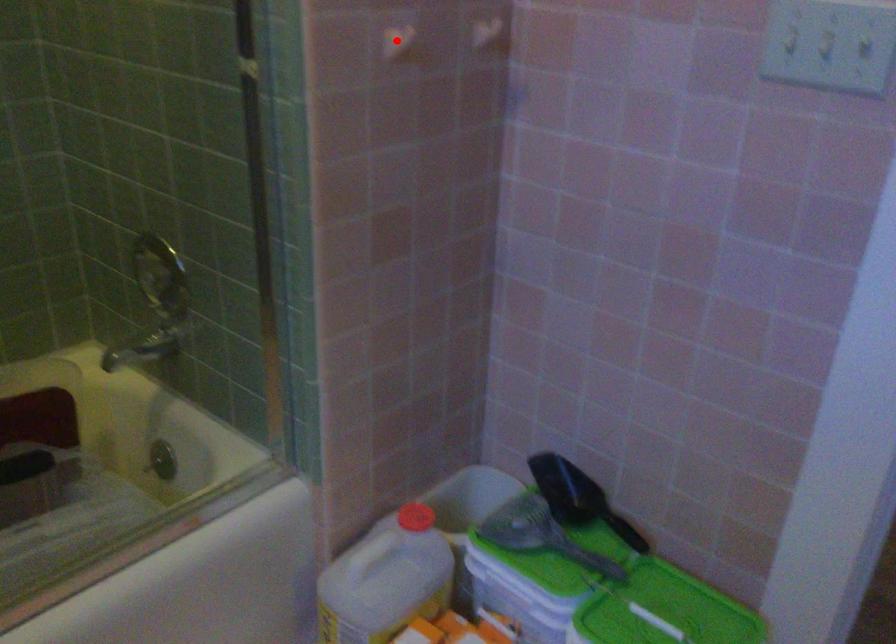
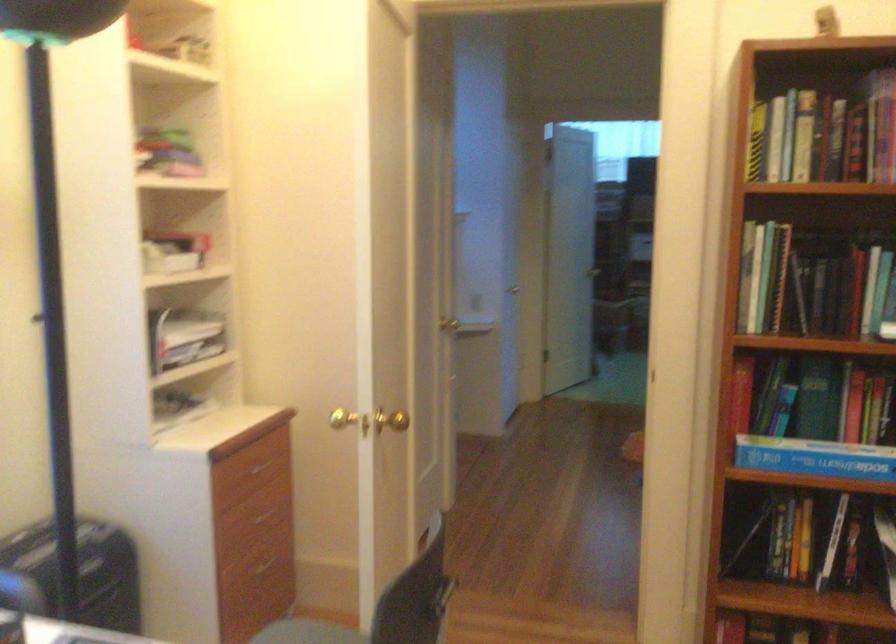
Question: I am providing you with two images of the same scene from different viewpoints. A red point is marked on the first image. At the location where the point appears in image 1, is it still visible in image 2?

Choices:
 (A) Yes
 (B) No

Answer: (B)